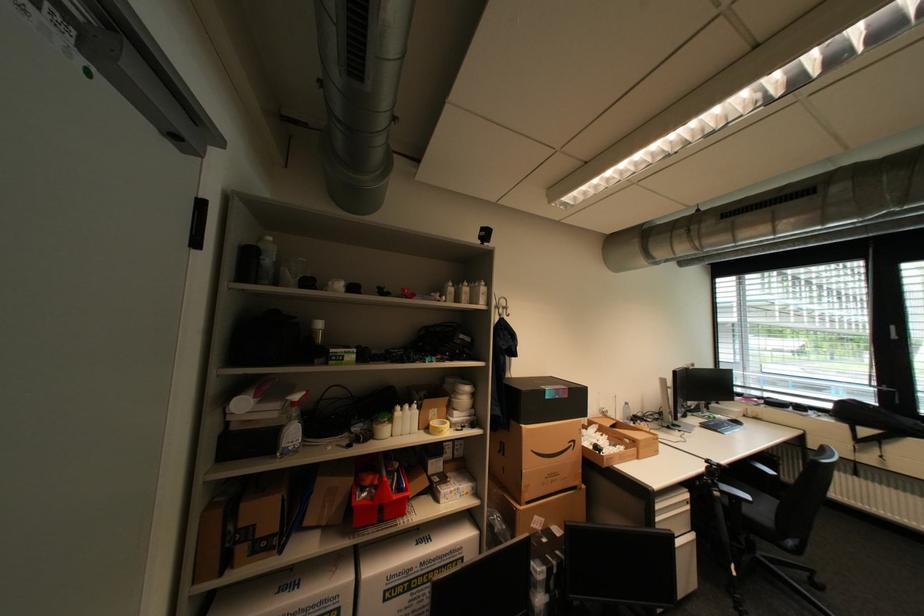
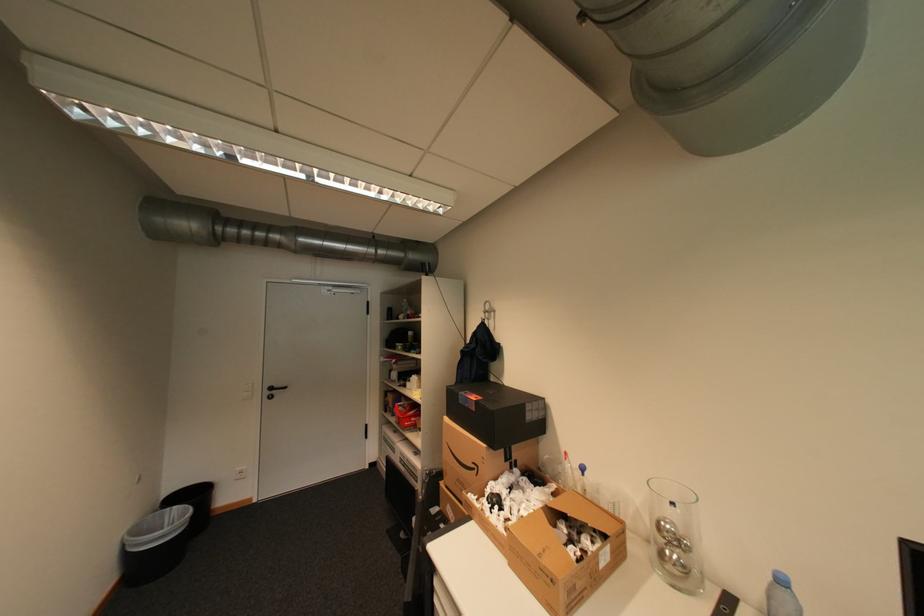
Locate, in the second image, the point that corresponds to point (580, 444) in the first image.

(484, 468)